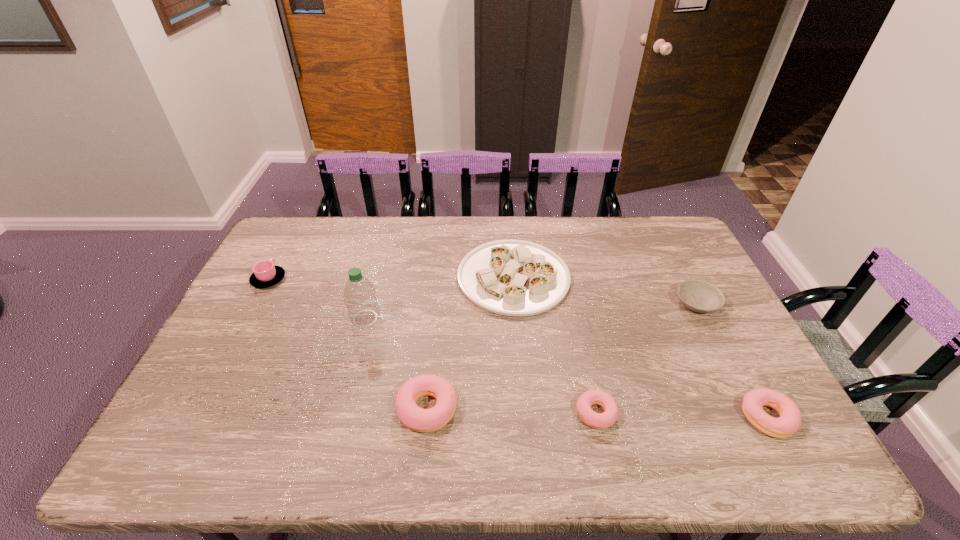
Where is `free space that is in between the second doughnut from left to right and the sixth object from right to left`? This screenshot has height=540, width=960. free space that is in between the second doughnut from left to right and the sixth object from right to left is located at coordinates (481, 366).

Identify the location of free space between the second tallest doughnut and the cup. (517, 348).

The image size is (960, 540). I want to click on free area in between the leftmost object and the platter, so click(391, 278).

Where is `object that is the fifth closest to the platter`? The height and width of the screenshot is (540, 960). object that is the fifth closest to the platter is located at coordinates (789, 422).

Identify which object is the third nearest to the tallest doughnut. Please provide its 2D coordinates. Your answer should be formatted as a tuple, i.e. [(x, y)], where the tuple contains the x and y coordinates of a point satisfying the conditions above.

[(606, 419)]

Locate which doughnut ranks in proximity to the leftmost doughnut. Please provide its 2D coordinates. Your answer should be formatted as a tuple, i.e. [(x, y)], where the tuple contains the x and y coordinates of a point satisfying the conditions above.

[(606, 419)]

The width and height of the screenshot is (960, 540). In order to click on the second closest doughnut to the shortest doughnut in this screenshot , I will do `click(789, 422)`.

Find the location of `free space that satisfies the following two spatial constraints: 1. on the front side of the platter; 2. on the right side of the rightmost doughnut`. free space that satisfies the following two spatial constraints: 1. on the front side of the platter; 2. on the right side of the rightmost doughnut is located at coordinates [525, 417].

Identify the location of free location that satisfies the following two spatial constraints: 1. on the front side of the shortest doughnut; 2. on the right side of the platter. The height and width of the screenshot is (540, 960). (525, 413).

Locate an element on the screen. The width and height of the screenshot is (960, 540). vacant area that satisfies the following two spatial constraints: 1. on the front side of the leftmost doughnut; 2. on the left side of the rightmost doughnut is located at coordinates (426, 417).